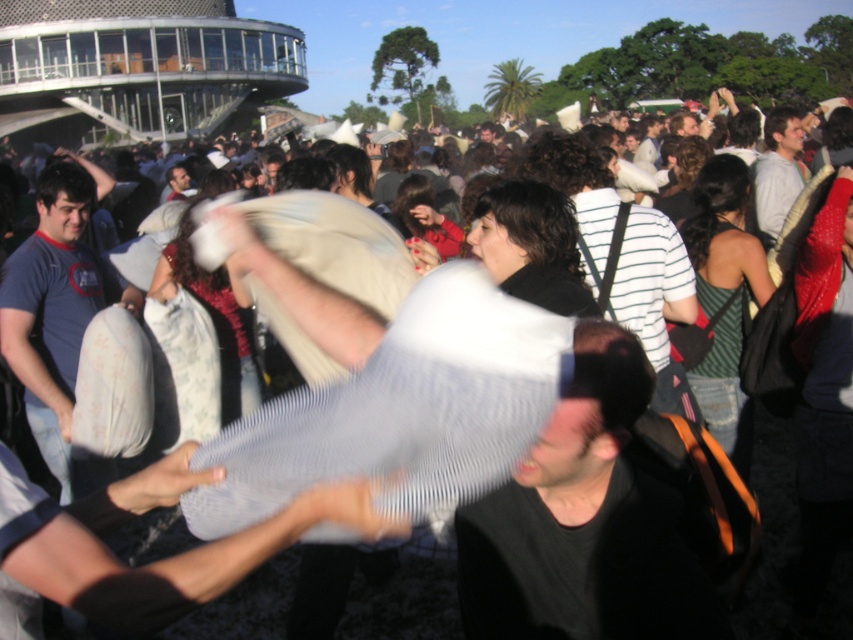
Does dark gray shirt at center have a greater height compared to matte white pillow at left?

No, dark gray shirt at center is not taller than matte white pillow at left.

Is dark gray shirt at center behind matte white pillow at left?

That is False.

Describe the element at coordinates (589, 518) in the screenshot. I see `dark gray shirt at center` at that location.

You are a GUI agent. You are given a task and a screenshot of the screen. Output one action in this format:
    pyautogui.click(x=<x>, y=<y>)
    Task: Click on the dark gray shirt at center
    This screenshot has width=853, height=640.
    Given the screenshot: What is the action you would take?
    pyautogui.click(x=589, y=518)